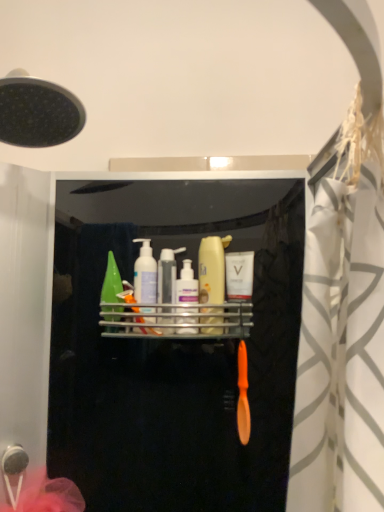
Question: Which direction should I rotate to look at translucent plastic mouthwash at center, which appears as the 3th mouthwash when viewed from the right, — up or down?

Choices:
 (A) down
 (B) up

Answer: (A)

Question: Is metallic silver shelf at center at the back of translucent green bottle at center, the fourth mouthwash in the right-to-left sequence?

Choices:
 (A) yes
 (B) no

Answer: (B)

Question: Does translucent green bottle at center, the fourth mouthwash in the right-to-left sequence, have a greater height compared to metallic silver shelf at center?

Choices:
 (A) yes
 (B) no

Answer: (A)

Question: From the image's perspective, is translucent green bottle at center, marked as the 2th mouthwash in a left-to-right arrangement, over metallic silver shelf at center?

Choices:
 (A) yes
 (B) no

Answer: (A)

Question: Is translucent green bottle at center, marked as the 2th mouthwash in a left-to-right arrangement, far away from metallic silver shelf at center?

Choices:
 (A) no
 (B) yes

Answer: (A)

Question: From a real-world perspective, is translucent green bottle at center, marked as the 2th mouthwash in a left-to-right arrangement, under metallic silver shelf at center?

Choices:
 (A) no
 (B) yes

Answer: (A)

Question: Is translucent green bottle at center, the fourth mouthwash in the right-to-left sequence, bigger than metallic silver shelf at center?

Choices:
 (A) yes
 (B) no

Answer: (B)

Question: Is translucent plastic mouthwash at center, which appears as the 3th mouthwash when viewed from the right, positioned beyond the bounds of translucent plastic mouthwash at center, positioned as the 2th mouthwash in right-to-left order?

Choices:
 (A) yes
 (B) no

Answer: (A)

Question: Is translucent plastic mouthwash at center, which appears as the 3th mouthwash when viewed from the right, bigger than translucent plastic mouthwash at center, placed as the fourth mouthwash when sorted from left to right?

Choices:
 (A) no
 (B) yes

Answer: (A)

Question: Could translucent plastic mouthwash at center, positioned as the 2th mouthwash in right-to-left order, be considered to be inside translucent plastic mouthwash at center, placed as the third mouthwash when sorted from left to right?

Choices:
 (A) yes
 (B) no

Answer: (B)

Question: Considering the relative sizes of translucent plastic mouthwash at center, placed as the third mouthwash when sorted from left to right, and translucent plastic mouthwash at center, positioned as the 2th mouthwash in right-to-left order, in the image provided, is translucent plastic mouthwash at center, placed as the third mouthwash when sorted from left to right, wider than translucent plastic mouthwash at center, positioned as the 2th mouthwash in right-to-left order,?

Choices:
 (A) yes
 (B) no

Answer: (A)

Question: From the image's perspective, does translucent plastic mouthwash at center, which appears as the 3th mouthwash when viewed from the right, appear lower than translucent plastic mouthwash at center, placed as the fourth mouthwash when sorted from left to right?

Choices:
 (A) yes
 (B) no

Answer: (A)

Question: From a real-world perspective, does translucent plastic mouthwash at center, which appears as the 3th mouthwash when viewed from the right, sit lower than translucent plastic mouthwash at center, positioned as the 2th mouthwash in right-to-left order?

Choices:
 (A) yes
 (B) no

Answer: (A)

Question: From a real-world perspective, is white glossy mouthwash at center, placed as the fifth mouthwash when sorted from left to right, below metallic silver shelf at center?

Choices:
 (A) no
 (B) yes

Answer: (A)